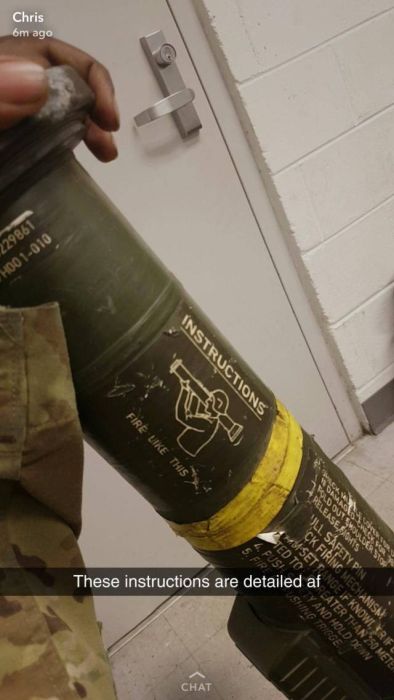
Where is `door`? The width and height of the screenshot is (394, 700). door is located at coordinates click(99, 532).